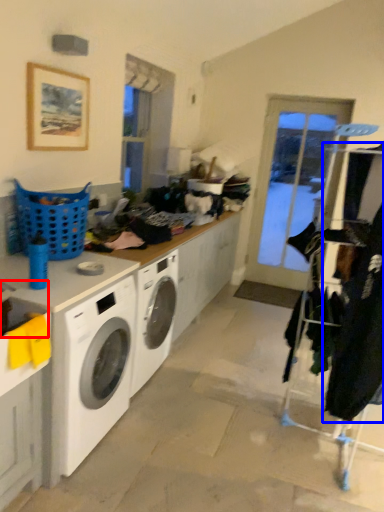
Question: Among these objects, which one is nearest to the camera, sink (highlighted by a red box) or clothing (highlighted by a blue box)?

Choices:
 (A) sink
 (B) clothing

Answer: (A)